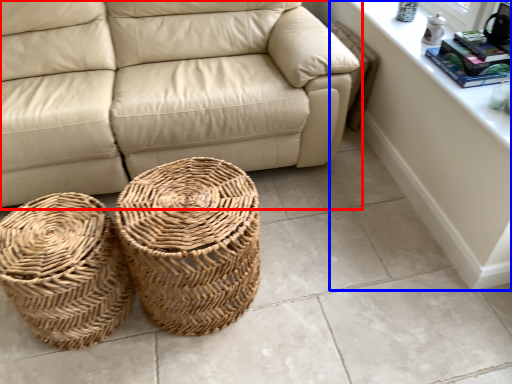
Question: Which of the following is the farthest to the observer, studio couch (highlighted by a red box) or dresser (highlighted by a blue box)?

Choices:
 (A) studio couch
 (B) dresser

Answer: (A)